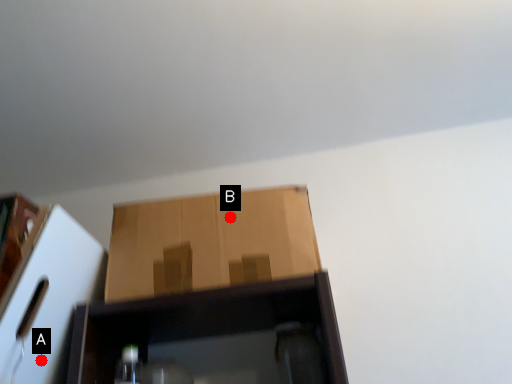
Question: Two points are circled on the image, labeled by A and B beside each circle. Which of the following is the closest to the observer?

Choices:
 (A) A is closer
 (B) B is closer

Answer: (A)